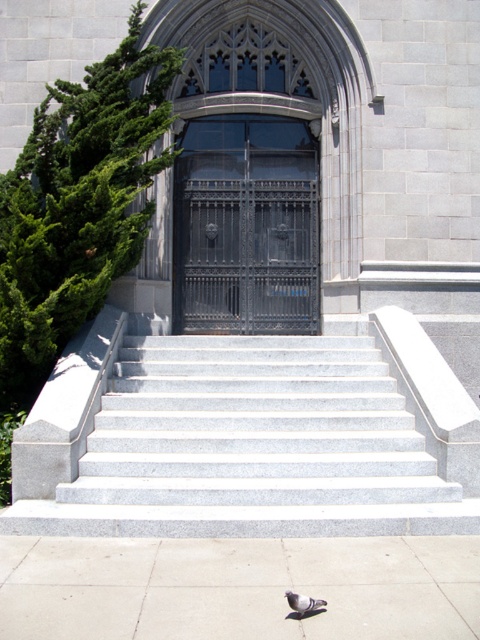
Question: Can you confirm if gray granite stairs at center is positioned to the left of black wrought iron door at center?

Choices:
 (A) yes
 (B) no

Answer: (A)

Question: Which of these objects is positioned farthest from the gray granite stairs at center?

Choices:
 (A) gray matte pigeon at lower center
 (B) black wrought iron door at center
 (C) smooth concrete pavement at lower center

Answer: (B)

Question: Can you confirm if gray granite stairs at center is positioned below black wrought iron door at center?

Choices:
 (A) no
 (B) yes

Answer: (B)

Question: Which of these objects is positioned closest to the gray granite stairs at center?

Choices:
 (A) black wrought iron door at center
 (B) gray matte pigeon at lower center

Answer: (B)

Question: Which point is closer to the camera taking this photo?

Choices:
 (A) (419, 506)
 (B) (299, 600)

Answer: (B)

Question: Does black wrought iron door at center appear over gray matte pigeon at lower center?

Choices:
 (A) yes
 (B) no

Answer: (A)